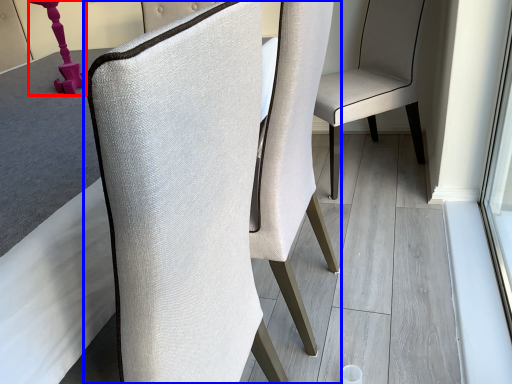
Question: Which object appears closest to the camera in this image, table lamp (highlighted by a red box) or chair (highlighted by a blue box)?

Choices:
 (A) table lamp
 (B) chair

Answer: (B)